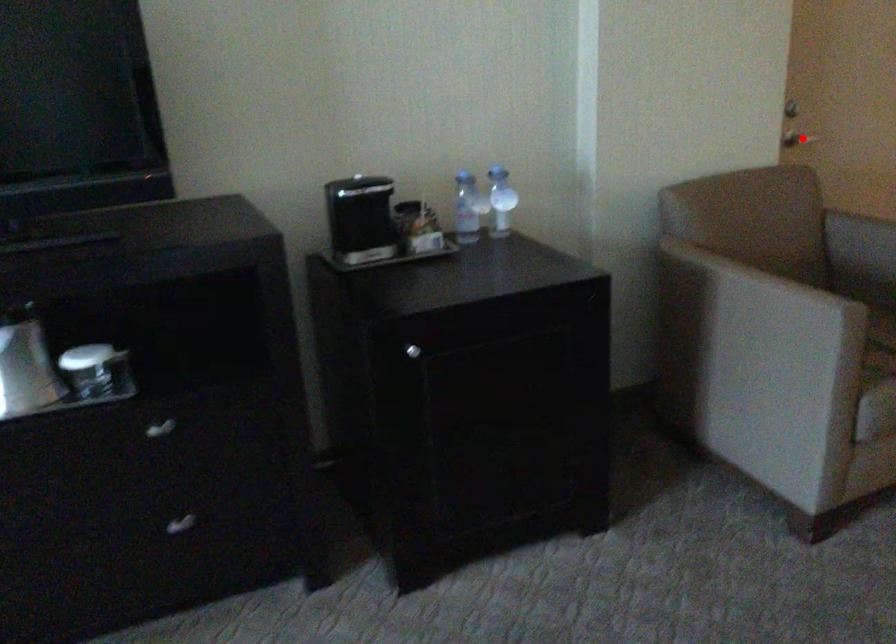
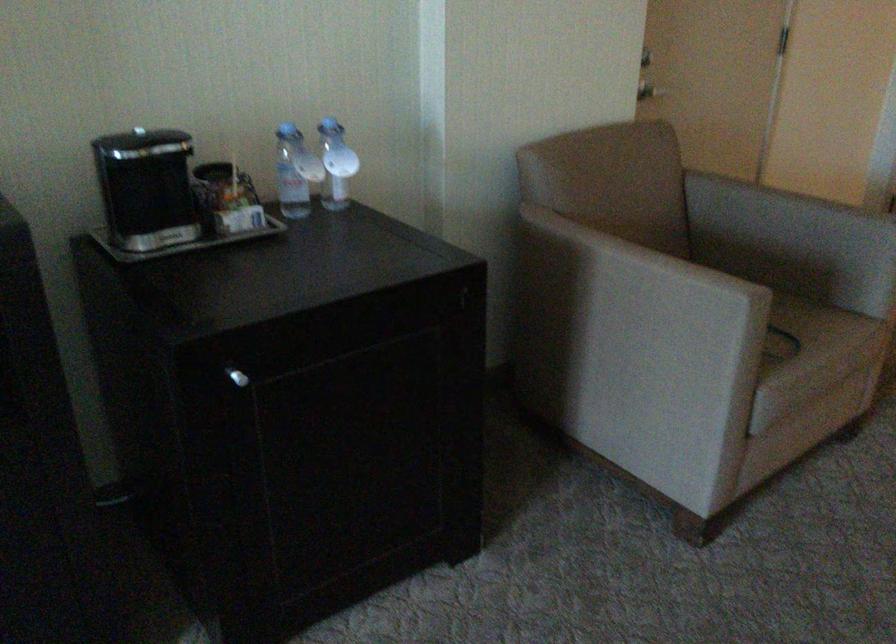
Find the pixel in the second image that matches the highlighted location in the first image.

(649, 90)